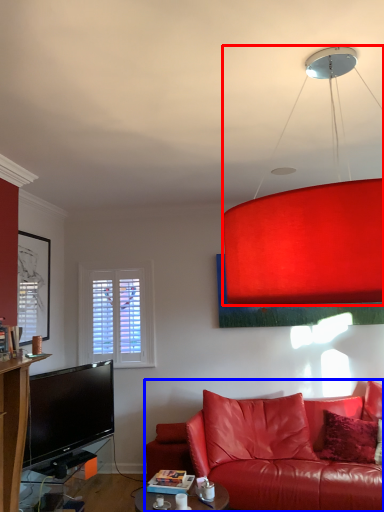
Question: Which object appears closest to the camera in this image, lamp (highlighted by a red box) or studio couch (highlighted by a blue box)?

Choices:
 (A) lamp
 (B) studio couch

Answer: (A)